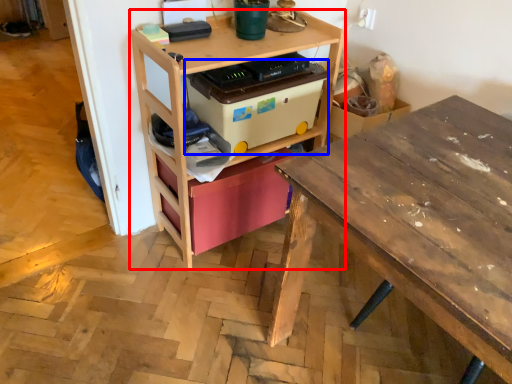
Question: Which object is further to the camera taking this photo, shelf (highlighted by a red box) or storage box (highlighted by a blue box)?

Choices:
 (A) shelf
 (B) storage box

Answer: (B)